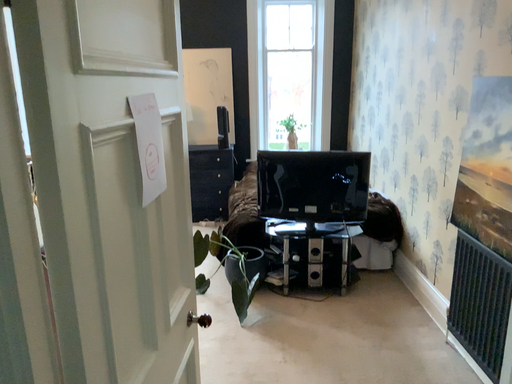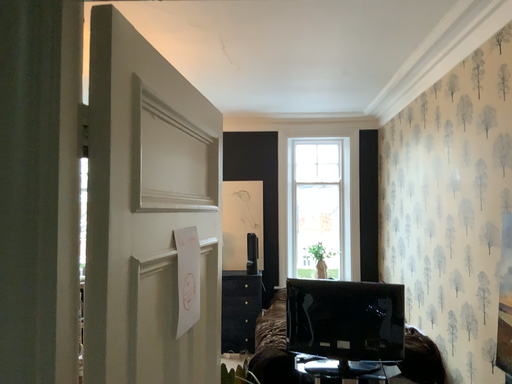
Question: Which way did the camera rotate in the video?

Choices:
 (A) rotated upward
 (B) rotated downward

Answer: (A)